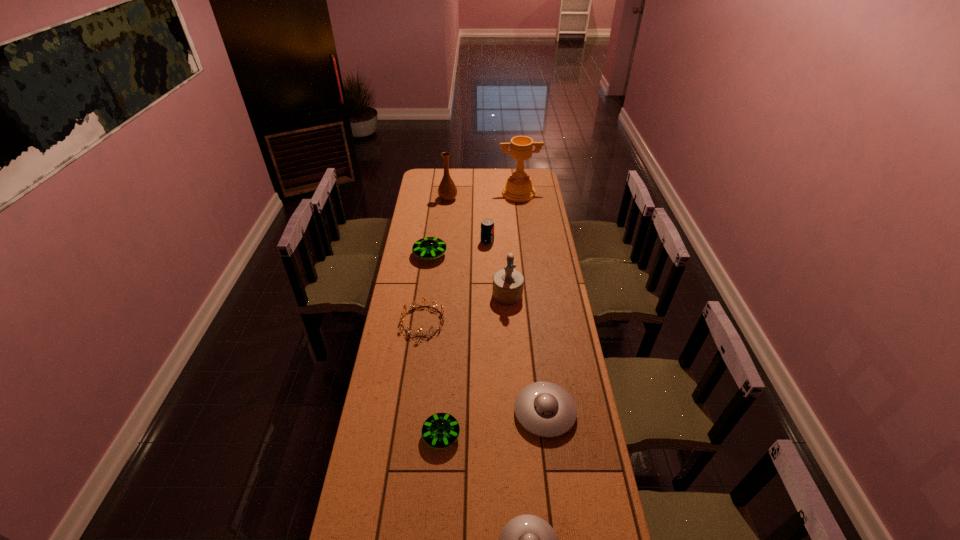
You are a GUI agent. You are given a task and a screenshot of the screen. Output one action in this format:
    pyautogui.click(x=<x>, y=<y>)
    Task: Click on the vacant point that satisfies the following two spatial constraints: 1. at the beak of the figurine; 2. on the right side of the farther gray saucer
    The height and width of the screenshot is (540, 960).
    Given the screenshot: What is the action you would take?
    pyautogui.click(x=516, y=412)